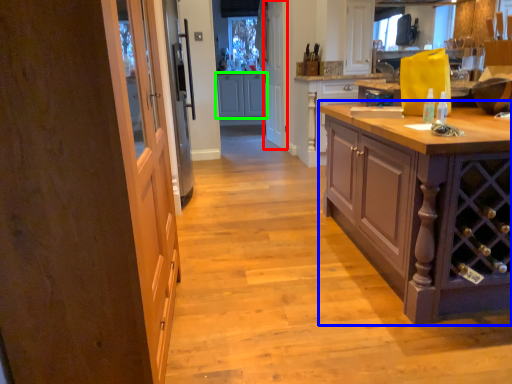
Question: Which object is positioned closest to screen door (highlighted by a red box)? Select from cabinetry (highlighted by a blue box) and cabinetry (highlighted by a green box).

Choices:
 (A) cabinetry
 (B) cabinetry

Answer: (B)